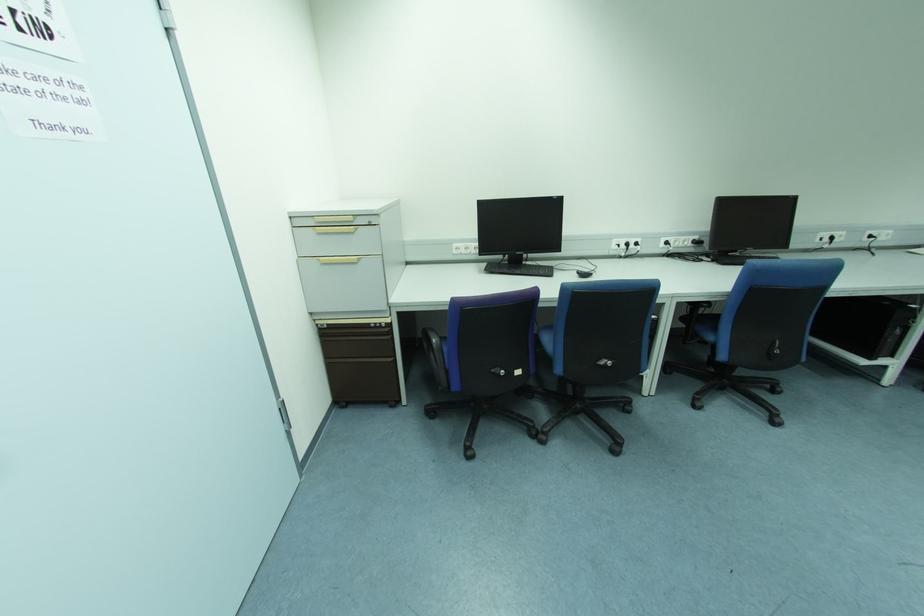
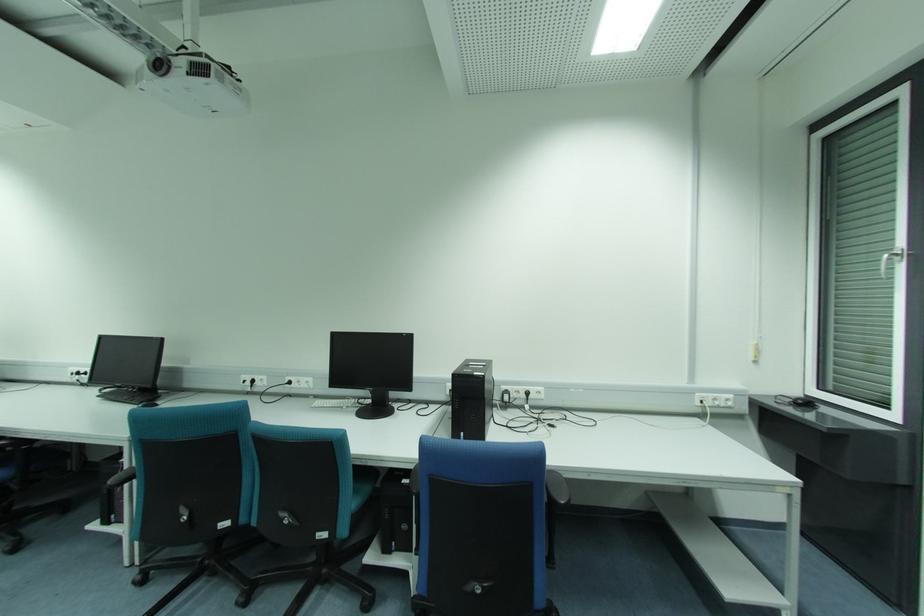
Locate, in the second image, the point that corresponds to the point at 871,237 in the first image.

(289, 383)